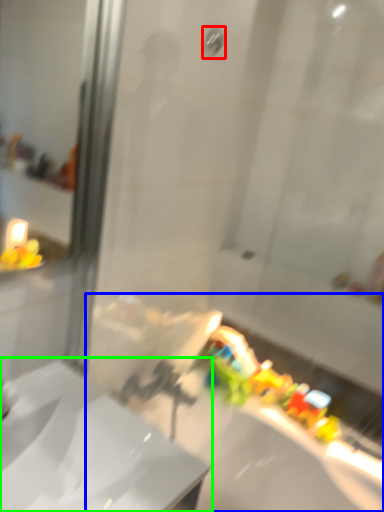
Question: Estimate the real-world distances between objects in this image. Which object is farther from shower (highlighted by a red box), bath (highlighted by a blue box) or sink (highlighted by a green box)?

Choices:
 (A) bath
 (B) sink

Answer: (A)